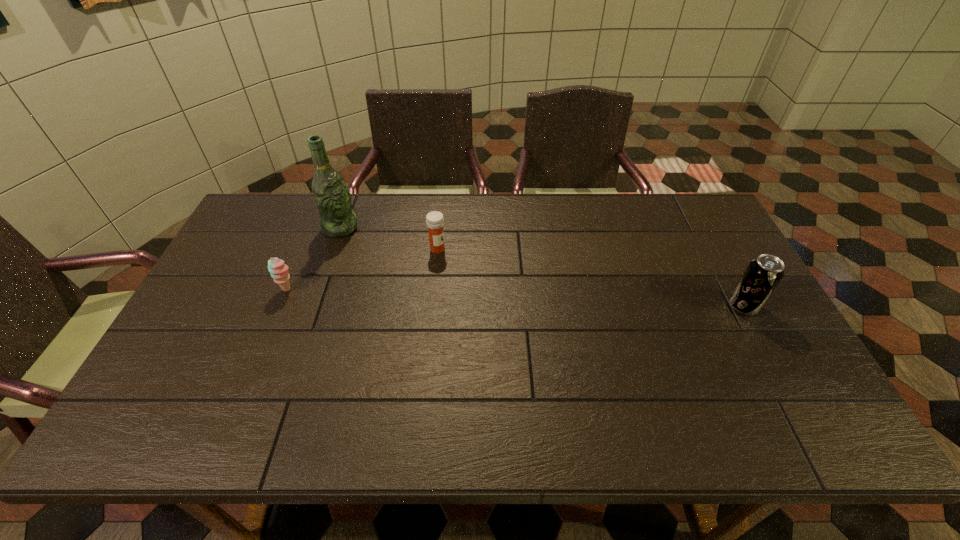
The image size is (960, 540). I want to click on the leftmost object, so pyautogui.click(x=279, y=271).

Identify the location of soda can. This screenshot has width=960, height=540. (763, 274).

Find the location of a particular element. Image resolution: width=960 pixels, height=540 pixels. the third shortest object is located at coordinates (763, 274).

Locate an element on the screen. The height and width of the screenshot is (540, 960). the third nearest object is located at coordinates (434, 220).

Where is `medicine`? This screenshot has height=540, width=960. medicine is located at coordinates (434, 220).

At what (x,y) coordinates should I click in order to perform the action: click on the tallest object. Please return your answer as a coordinate pair (x, y). The width and height of the screenshot is (960, 540). Looking at the image, I should click on (331, 195).

Where is `the farthest object`? The image size is (960, 540). the farthest object is located at coordinates (331, 195).

I want to click on vacant region located on the back of the sherbert, so click(x=307, y=242).

I want to click on vacant space located 0.210m on the left of the soda can, so click(x=654, y=306).

Find the location of a particular element. This screenshot has height=540, width=960. vacant space located 0.130m on the label side of the third nearest object is located at coordinates (477, 270).